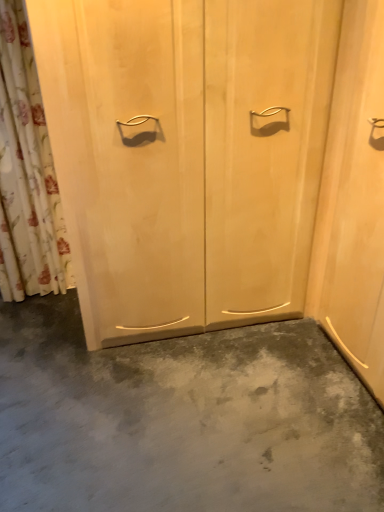
Question: Is light wood/texture door at center further to camera compared to gray matte concrete at center?

Choices:
 (A) yes
 (B) no

Answer: (A)

Question: From the image's perspective, is light wood/texture door at center on gray matte concrete at center?

Choices:
 (A) no
 (B) yes

Answer: (B)

Question: Would you consider light wood/texture door at center to be distant from gray matte concrete at center?

Choices:
 (A) yes
 (B) no

Answer: (B)

Question: Can gray matte concrete at center be found inside light wood/texture door at center?

Choices:
 (A) yes
 (B) no

Answer: (B)

Question: Is light wood/texture door at center positioned before gray matte concrete at center?

Choices:
 (A) no
 (B) yes

Answer: (A)

Question: From the image's perspective, is light wood/texture door at center located beneath gray matte concrete at center?

Choices:
 (A) yes
 (B) no

Answer: (B)

Question: Is floral fabric shower curtain at left at the left side of light wood/texture door at center?

Choices:
 (A) yes
 (B) no

Answer: (A)

Question: From a real-world perspective, does floral fabric shower curtain at left sit lower than light wood/texture door at center?

Choices:
 (A) no
 (B) yes

Answer: (A)

Question: Does floral fabric shower curtain at left have a greater width compared to light wood/texture door at center?

Choices:
 (A) yes
 (B) no

Answer: (B)

Question: From a real-world perspective, is floral fabric shower curtain at left on top of light wood/texture door at center?

Choices:
 (A) no
 (B) yes

Answer: (B)

Question: Is floral fabric shower curtain at left smaller than light wood/texture door at center?

Choices:
 (A) yes
 (B) no

Answer: (A)

Question: Does floral fabric shower curtain at left lie in front of light wood/texture door at center?

Choices:
 (A) yes
 (B) no

Answer: (B)

Question: Does floral fabric shower curtain at left have a larger size compared to gray matte concrete at center?

Choices:
 (A) no
 (B) yes

Answer: (A)